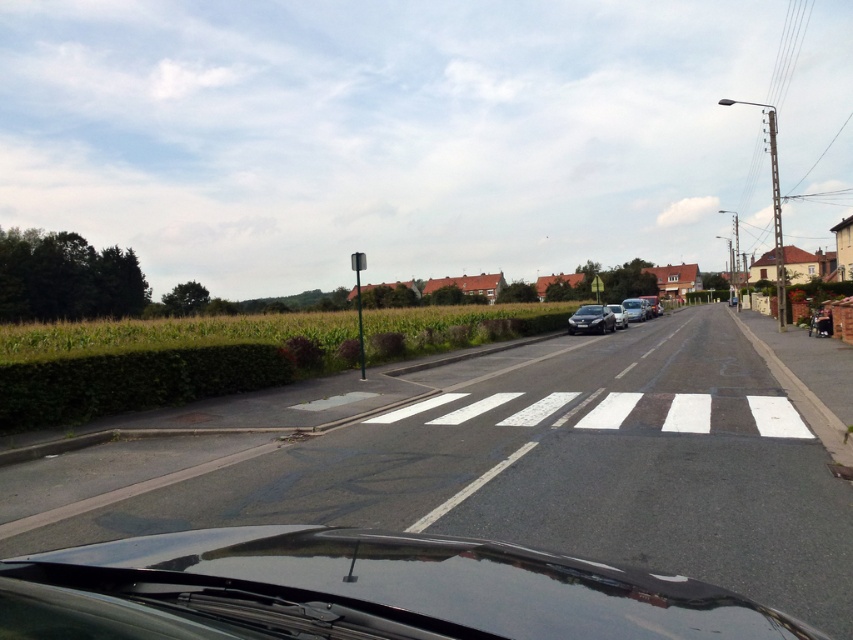
Is silver metallic car at right shorter than silver metallic car at center-right?

In fact, silver metallic car at right may be taller than silver metallic car at center-right.

Is silver metallic car at right bigger than silver metallic car at center-right?

Yes.

At what (x,y) coordinates should I click in order to perform the action: click on silver metallic car at right. Please return your answer as a coordinate pair (x, y). Image resolution: width=853 pixels, height=640 pixels. Looking at the image, I should click on (634, 308).

Between point (619, 323) and point (639, 296), which one is positioned behind?

The point (639, 296) is more distant.

Does point (625, 316) lie in front of point (651, 300)?

That is True.

This screenshot has height=640, width=853. Find the location of `silver metallic car at center-right`. silver metallic car at center-right is located at coordinates (618, 316).

Measure the distance from glossy black car at center to silver metallic car at center-right.

glossy black car at center and silver metallic car at center-right are 35.03 meters apart from each other.

Between glossy black car at center and silver metallic car at center-right, which one appears on the right side from the viewer's perspective?

silver metallic car at center-right

The width and height of the screenshot is (853, 640). Identify the location of glossy black car at center. (358, 592).